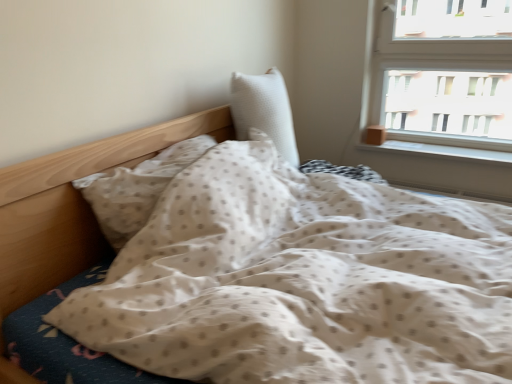
Question: Considering their positions, is white smooth window sill at right located in front of or behind white textured pillow at center, the second pillow positioned from the left?

Choices:
 (A) front
 (B) behind

Answer: (B)

Question: Which is correct: white smooth window sill at right is inside white textured pillow at center, the second pillow positioned from the left, or outside of it?

Choices:
 (A) outside
 (B) inside

Answer: (A)

Question: Considering the real-world distances, which object is closest to the white textured pillow at center, the first pillow viewed from the right?

Choices:
 (A) white smooth window sill at right
 (B) white dotted fabric pillow at center, positioned as the first pillow in left-to-right order

Answer: (B)

Question: Based on their relative distances, which object is farther from the white textured pillow at center, the first pillow viewed from the right?

Choices:
 (A) white dotted fabric pillow at center, the second pillow viewed from the right
 (B) white smooth window sill at right

Answer: (B)